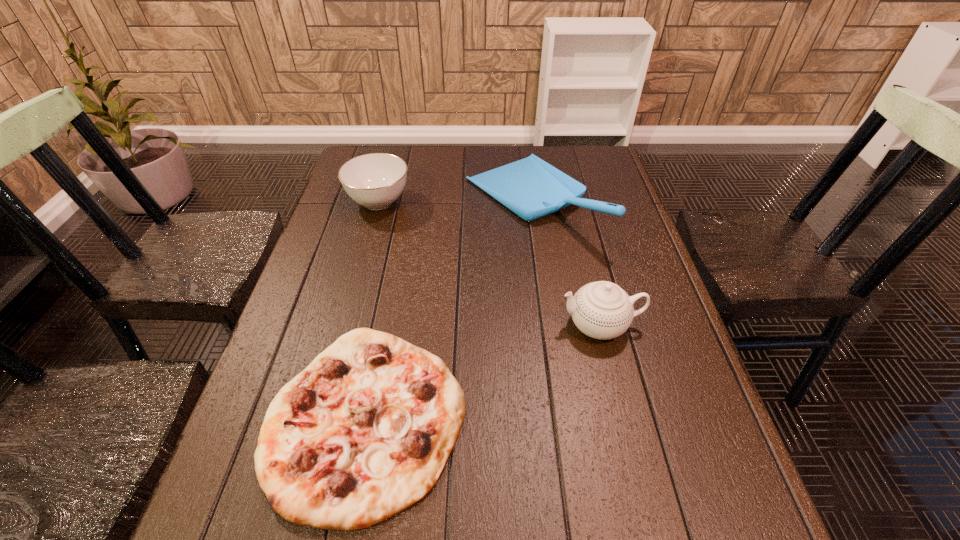
Identify the location of object that is positioned at the near left corner. (364, 432).

The image size is (960, 540). Find the location of `object that is at the far right corner`. object that is at the far right corner is located at coordinates (532, 188).

In the image, there is a desktop. Where is `blank space at the far edge`? blank space at the far edge is located at coordinates (505, 146).

At what (x,y) coordinates should I click in order to perform the action: click on vacant space at the right edge. Please return your answer as a coordinate pair (x, y). Looking at the image, I should click on (654, 286).

Image resolution: width=960 pixels, height=540 pixels. In the image, there is a desktop. In order to click on vacant space at the far left corner in this screenshot , I will do `click(352, 154)`.

At what (x,y) coordinates should I click in order to perform the action: click on free point at the far right corner. Please return your answer as a coordinate pair (x, y). The image size is (960, 540). Looking at the image, I should click on (590, 179).

I want to click on free point between the shorter chinaware and the nearer chinaware, so click(490, 263).

At what (x,y) coordinates should I click in order to perform the action: click on vacant space that's between the farther chinaware and the dustpan. Please return your answer as a coordinate pair (x, y). This screenshot has width=960, height=540. Looking at the image, I should click on (455, 201).

Find the location of a particular element. This screenshot has height=540, width=960. empty space that is in between the right chinaware and the tallest object is located at coordinates (565, 263).

Image resolution: width=960 pixels, height=540 pixels. Find the location of `free space between the dustpan and the shortest object`. free space between the dustpan and the shortest object is located at coordinates (448, 309).